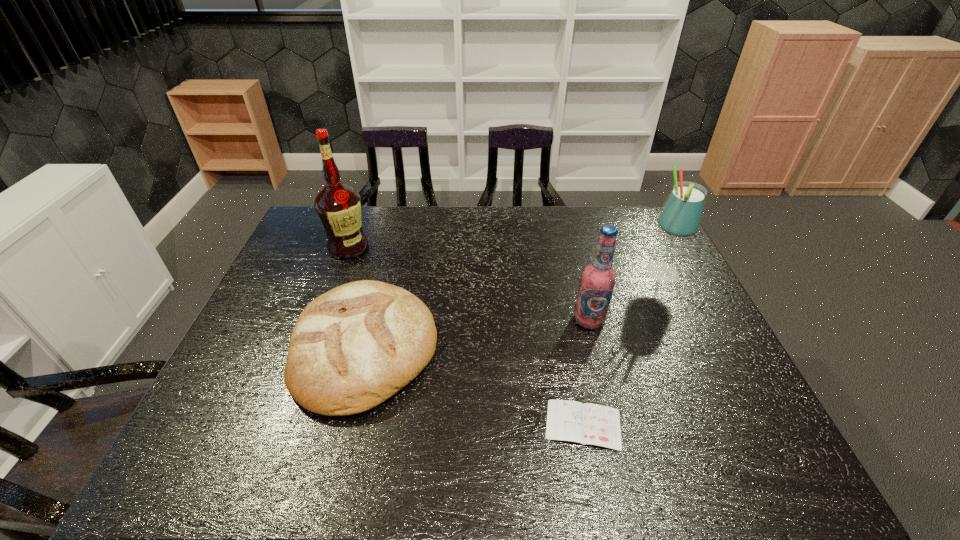
Image resolution: width=960 pixels, height=540 pixels. I want to click on the leftmost alcohol, so click(x=338, y=206).

Find the location of a particular element. the rightmost object is located at coordinates (681, 216).

This screenshot has width=960, height=540. I want to click on the shortest alcohol, so click(x=598, y=278).

Identify the location of the nearest alcohol. (598, 278).

Identify the location of the fourth tallest object. (352, 348).

Identify the location of the shortest object. The height and width of the screenshot is (540, 960). (588, 424).

Identify the location of vacant space located on the label of the leftmost alcohol. The width and height of the screenshot is (960, 540). (338, 277).

Locate an element on the screen. This screenshot has width=960, height=540. vacant space situated on the back of the rightmost alcohol is located at coordinates (649, 247).

At what (x,y) coordinates should I click in order to perform the action: click on vacant space situated 0.210m on the back of the nearest alcohol. Please return your answer as a coordinate pair (x, y). Looking at the image, I should click on (x=574, y=262).

Where is `vacant region located 0.160m on the right of the fourth tallest object`? vacant region located 0.160m on the right of the fourth tallest object is located at coordinates (498, 349).